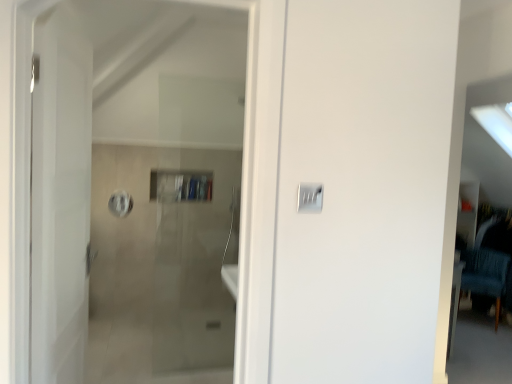
Question: Does white glossy door at left turn towards satin silver switch at center?

Choices:
 (A) no
 (B) yes

Answer: (B)

Question: Would you consider white glossy door at left to be distant from satin silver switch at center?

Choices:
 (A) no
 (B) yes

Answer: (A)

Question: Can you confirm if white glossy door at left is positioned to the left of satin silver switch at center?

Choices:
 (A) yes
 (B) no

Answer: (A)

Question: From the image's perspective, is white glossy door at left on satin silver switch at center?

Choices:
 (A) no
 (B) yes

Answer: (A)

Question: From the image's perspective, is white glossy door at left below satin silver switch at center?

Choices:
 (A) yes
 (B) no

Answer: (A)

Question: Considering the relative sizes of white glossy door at left and satin silver switch at center in the image provided, is white glossy door at left smaller than satin silver switch at center?

Choices:
 (A) yes
 (B) no

Answer: (B)

Question: Can you confirm if blue fabric chair at right is shorter than satin silver switch at center?

Choices:
 (A) no
 (B) yes

Answer: (A)

Question: Does blue fabric chair at right appear on the right side of satin silver switch at center?

Choices:
 (A) no
 (B) yes

Answer: (B)

Question: Can you confirm if blue fabric chair at right is thinner than satin silver switch at center?

Choices:
 (A) no
 (B) yes

Answer: (A)

Question: From the image's perspective, is blue fabric chair at right under satin silver switch at center?

Choices:
 (A) yes
 (B) no

Answer: (A)

Question: Considering the relative positions of blue fabric chair at right and satin silver switch at center in the image provided, is blue fabric chair at right in front of satin silver switch at center?

Choices:
 (A) yes
 (B) no

Answer: (B)

Question: From a real-world perspective, does blue fabric chair at right sit lower than satin silver switch at center?

Choices:
 (A) yes
 (B) no

Answer: (A)

Question: Is white glossy door at left a part of satin silver switch at center?

Choices:
 (A) yes
 (B) no

Answer: (B)